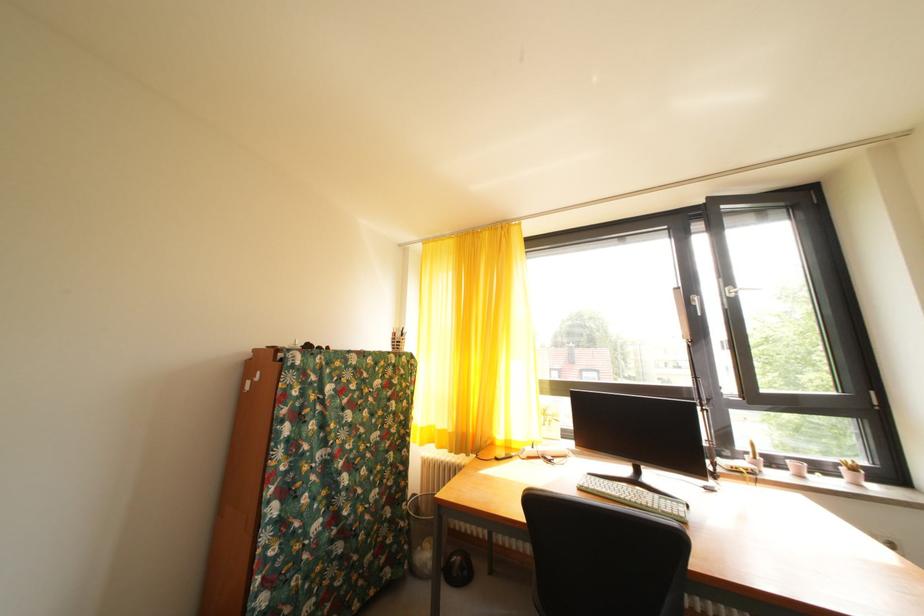
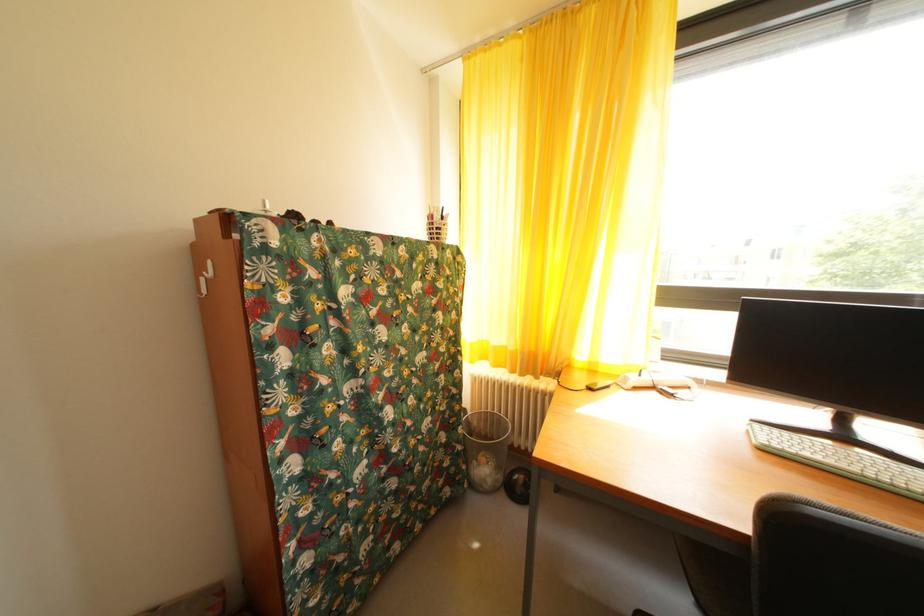
In the second image, find the point that corresponds to [624,500] in the first image.

(854, 472)